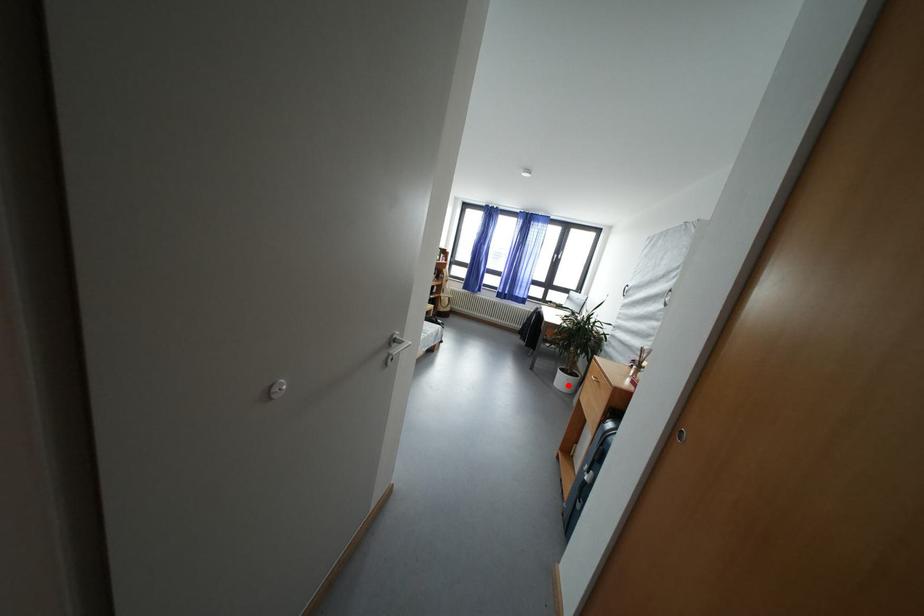
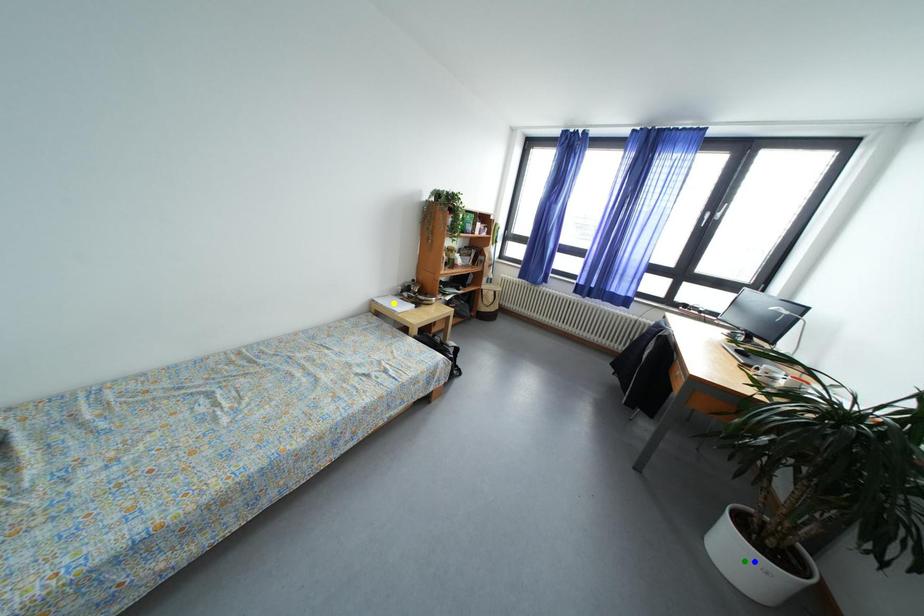
Question: I am providing you with two images of the same scene from different viewpoints. A red point is marked on the first image. You are given multiple points on the second image. In image 2, which mark is for the same physical point as the one in image 1?

Choices:
 (A) green point
 (B) yellow point
 (C) blue point

Answer: (A)